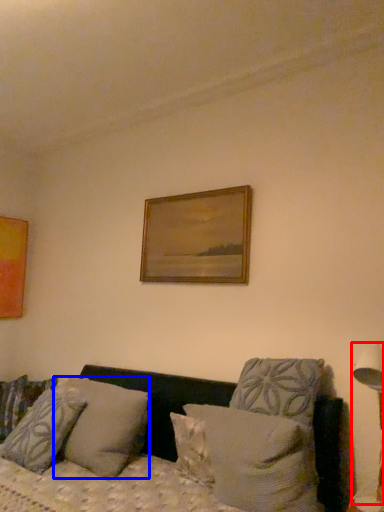
Question: Which point is closer to the camera, table lamp (highlighted by a red box) or pillow (highlighted by a blue box)?

Choices:
 (A) table lamp
 (B) pillow

Answer: (A)